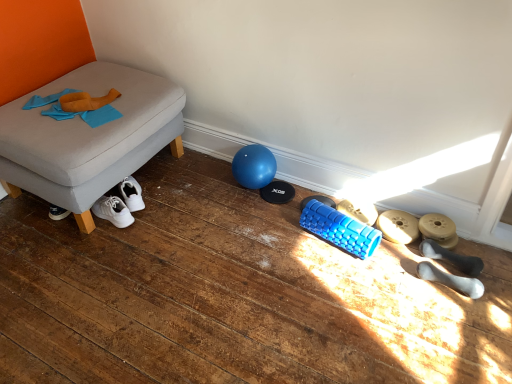
At what (x,y) coordinates should I click in order to perform the action: click on white rubber dumbbells at lower right, the 2th footwear from the front. Please return your answer as a coordinate pair (x, y). The width and height of the screenshot is (512, 384). Looking at the image, I should click on (452, 258).

What do you see at coordinates (451, 280) in the screenshot?
I see `white rubber dumbbell at lower right, which ranks as the first footwear in front-to-back order` at bounding box center [451, 280].

What is the approximate height of gray fabric ottoman at left?

The height of gray fabric ottoman at left is 18.77 inches.

The image size is (512, 384). I want to click on matte gold dumbbell at lower right, positioned as the 3th footwear in back-to-front order, so click(438, 229).

This screenshot has height=384, width=512. I want to click on white rubber dumbbells at lower right, the 2th footwear from the front, so click(452, 258).

Between gray fabric ottoman at left and blue rubber roller at lower center, the fifth footwear positioned from the front, which one has smaller size?

blue rubber roller at lower center, the fifth footwear positioned from the front.

Is gray fabric ottoman at left completely or partially outside of blue rubber roller at lower center, the fifth footwear positioned from the front?

Yes.

Starting from the gray fabric ottoman at left, which footwear is the 1st one to the right? Please provide its 2D coordinates.

[(359, 211)]

From the image's perspective, between gray fabric ottoman at left and blue rubber roller at lower center, which ranks as the first footwear in back-to-front order, which one is located above?

gray fabric ottoman at left appears higher in the image.

Can you confirm if gray fabric ottoman at left is shorter than white rubber dumbbells at lower right, the 4th footwear from the back?

No.

Does gray fabric ottoman at left appear on the right side of white rubber dumbbells at lower right, the 4th footwear from the back?

Incorrect, gray fabric ottoman at left is not on the right side of white rubber dumbbells at lower right, the 4th footwear from the back.

The width and height of the screenshot is (512, 384). What are the coordinates of `the 1st footwear behind the gray fabric ottoman at left, starting your count from the anchor` in the screenshot? It's located at (452, 258).

Visually, is white rubber dumbbell at lower right, placed as the 5th footwear when sorted from back to front, positioned to the left or to the right of matte gold dumbbell at lower right, acting as the third footwear starting from the front?

white rubber dumbbell at lower right, placed as the 5th footwear when sorted from back to front, is positioned on matte gold dumbbell at lower right, acting as the third footwear starting from the front,'s left side.

Is white rubber dumbbell at lower right, which ranks as the first footwear in front-to-back order, aimed at matte gold dumbbell at lower right, acting as the third footwear starting from the front?

No, white rubber dumbbell at lower right, which ranks as the first footwear in front-to-back order, is not facing towards matte gold dumbbell at lower right, acting as the third footwear starting from the front.

Which is behind, white rubber dumbbell at lower right, which ranks as the first footwear in front-to-back order, or matte gold dumbbell at lower right, acting as the third footwear starting from the front?

matte gold dumbbell at lower right, acting as the third footwear starting from the front, is further away from the camera.

From the image's perspective, does white rubber dumbbell at lower right, which ranks as the first footwear in front-to-back order, appear higher than matte gold dumbbell at lower right, acting as the third footwear starting from the front?

No, from the image's perspective, white rubber dumbbell at lower right, which ranks as the first footwear in front-to-back order, is not above matte gold dumbbell at lower right, acting as the third footwear starting from the front.

Are white rubber dumbbells at lower right, the 4th footwear from the back, and matte gray dumbbell at lower right, which appears as the 4th footwear when viewed from the front, located far from each other?

white rubber dumbbells at lower right, the 4th footwear from the back, is near matte gray dumbbell at lower right, which appears as the 4th footwear when viewed from the front, not far away.

Considering the relative positions of white rubber dumbbells at lower right, the 2th footwear from the front, and matte gray dumbbell at lower right, which appears as the 4th footwear when viewed from the front, in the image provided, is white rubber dumbbells at lower right, the 2th footwear from the front, to the left of matte gray dumbbell at lower right, which appears as the 4th footwear when viewed from the front, from the viewer's perspective?

No.

From a real-world perspective, is white rubber dumbbells at lower right, the 2th footwear from the front, over matte gray dumbbell at lower right, which appears as the 4th footwear when viewed from the front?

Yes, from a real-world perspective, white rubber dumbbells at lower right, the 2th footwear from the front, is above matte gray dumbbell at lower right, which appears as the 4th footwear when viewed from the front.

What's the angular difference between white rubber dumbbell at lower right, which ranks as the first footwear in front-to-back order, and blue rubber roller at lower center, which ranks as the first footwear in back-to-front order,'s facing directions?

The facing directions of white rubber dumbbell at lower right, which ranks as the first footwear in front-to-back order, and blue rubber roller at lower center, which ranks as the first footwear in back-to-front order, are 2.9 degrees apart.

From the picture: Is white rubber dumbbell at lower right, which ranks as the first footwear in front-to-back order, thinner than blue rubber roller at lower center, the fifth footwear positioned from the front?

Yes.

Between white rubber dumbbell at lower right, which ranks as the first footwear in front-to-back order, and blue rubber roller at lower center, the fifth footwear positioned from the front, which one appears on the left side from the viewer's perspective?

blue rubber roller at lower center, the fifth footwear positioned from the front, is more to the left.

From the image's perspective, who appears lower, white rubber dumbbell at lower right, which ranks as the first footwear in front-to-back order, or blue rubber roller at lower center, which ranks as the first footwear in back-to-front order?

white rubber dumbbell at lower right, which ranks as the first footwear in front-to-back order, is shown below in the image.

Which point is more distant from viewer, (452,238) or (432,271)?

Positioned behind is point (452,238).

From a real-world perspective, which object stands above the other?

white rubber dumbbell at lower right, which ranks as the first footwear in front-to-back order.

Is white rubber dumbbell at lower right, placed as the 5th footwear when sorted from back to front, completely or partially inside matte gold dumbbell at lower right, positioned as the 3th footwear in back-to-front order?

No, white rubber dumbbell at lower right, placed as the 5th footwear when sorted from back to front, is located outside of matte gold dumbbell at lower right, positioned as the 3th footwear in back-to-front order.

From the picture: Considering the sizes of objects matte gold dumbbell at lower right, positioned as the 3th footwear in back-to-front order, and white rubber dumbbell at lower right, placed as the 5th footwear when sorted from back to front, in the image provided, who is bigger, matte gold dumbbell at lower right, positioned as the 3th footwear in back-to-front order, or white rubber dumbbell at lower right, placed as the 5th footwear when sorted from back to front,?

white rubber dumbbell at lower right, placed as the 5th footwear when sorted from back to front.

Where is `footwear that is the 1st object to the right of the matte gray dumbbell at lower right, the 2th footwear positioned from the back, starting at the anchor`? footwear that is the 1st object to the right of the matte gray dumbbell at lower right, the 2th footwear positioned from the back, starting at the anchor is located at coordinates (451, 280).

Is white rubber dumbbell at lower right, placed as the 5th footwear when sorted from back to front, wider or thinner than matte gray dumbbell at lower right, which appears as the 4th footwear when viewed from the front?

Clearly, white rubber dumbbell at lower right, placed as the 5th footwear when sorted from back to front, has less width compared to matte gray dumbbell at lower right, which appears as the 4th footwear when viewed from the front.

From a real-world perspective, does white rubber dumbbell at lower right, which ranks as the first footwear in front-to-back order, stand above matte gray dumbbell at lower right, the 2th footwear positioned from the back?

Yes, from a real-world perspective, white rubber dumbbell at lower right, which ranks as the first footwear in front-to-back order, is on top of matte gray dumbbell at lower right, the 2th footwear positioned from the back.

This screenshot has height=384, width=512. There is a blue rubber roller at lower center, which ranks as the first footwear in back-to-front order. In order to click on furniture above it (from a real-world perspective) in this screenshot , I will do `click(89, 136)`.

Find the location of a particular element. This screenshot has height=384, width=512. the 4th footwear below the gray fabric ottoman at left (from the image's perspective) is located at coordinates (452, 258).

Based on their spatial positions, is blue rubber roller at lower center, which ranks as the first footwear in back-to-front order, or white rubber dumbbell at lower right, placed as the 5th footwear when sorted from back to front, closer to matte gold dumbbell at lower right, positioned as the 3th footwear in back-to-front order?

Among the two, white rubber dumbbell at lower right, placed as the 5th footwear when sorted from back to front, is located nearer to matte gold dumbbell at lower right, positioned as the 3th footwear in back-to-front order.

Considering their positions, is white rubber dumbbells at lower right, the 2th footwear from the front, positioned further to matte gold dumbbell at lower right, acting as the third footwear starting from the front, than gray fabric ottoman at left?

gray fabric ottoman at left lies further to matte gold dumbbell at lower right, acting as the third footwear starting from the front, than the other object.

From the image, which object appears to be nearer to gray fabric ottoman at left, white rubber dumbbell at lower right, placed as the 5th footwear when sorted from back to front, or matte gray dumbbell at lower right, which appears as the 4th footwear when viewed from the front?

Among the two, matte gray dumbbell at lower right, which appears as the 4th footwear when viewed from the front, is located nearer to gray fabric ottoman at left.

Looking at the image, which one is located further to white rubber dumbbell at lower right, placed as the 5th footwear when sorted from back to front, blue rubber roller at lower center, which ranks as the first footwear in back-to-front order, or white rubber dumbbells at lower right, the 4th footwear from the back?

blue rubber roller at lower center, which ranks as the first footwear in back-to-front order.

Looking at the image, which one is located further to white rubber dumbbells at lower right, the 2th footwear from the front, gray fabric ottoman at left or white rubber dumbbell at lower right, which ranks as the first footwear in front-to-back order?

gray fabric ottoman at left is positioned further to the anchor white rubber dumbbells at lower right, the 2th footwear from the front.

Looking at the image, which one is located closer to matte gray dumbbell at lower right, the 2th footwear positioned from the back, matte gold dumbbell at lower right, positioned as the 3th footwear in back-to-front order, or white rubber dumbbells at lower right, the 4th footwear from the back?

Based on the image, matte gold dumbbell at lower right, positioned as the 3th footwear in back-to-front order, appears to be nearer to matte gray dumbbell at lower right, the 2th footwear positioned from the back.

Estimate the real-world distances between objects in this image. Which object is further from matte gray dumbbell at lower right, which appears as the 4th footwear when viewed from the front, white rubber dumbbell at lower right, which ranks as the first footwear in front-to-back order, or matte gold dumbbell at lower right, positioned as the 3th footwear in back-to-front order?

Based on the image, white rubber dumbbell at lower right, which ranks as the first footwear in front-to-back order, appears to be further to matte gray dumbbell at lower right, which appears as the 4th footwear when viewed from the front.

Considering their positions, is white rubber dumbbells at lower right, the 4th footwear from the back, positioned further to white rubber dumbbell at lower right, which ranks as the first footwear in front-to-back order, than matte gold dumbbell at lower right, acting as the third footwear starting from the front?

matte gold dumbbell at lower right, acting as the third footwear starting from the front, is further to white rubber dumbbell at lower right, which ranks as the first footwear in front-to-back order.

Where is `footwear positioned between white rubber dumbbell at lower right, placed as the 5th footwear when sorted from back to front, and matte gold dumbbell at lower right, acting as the third footwear starting from the front, from near to far`? This screenshot has width=512, height=384. footwear positioned between white rubber dumbbell at lower right, placed as the 5th footwear when sorted from back to front, and matte gold dumbbell at lower right, acting as the third footwear starting from the front, from near to far is located at coordinates (452, 258).

Image resolution: width=512 pixels, height=384 pixels. Find the location of `footwear located between gray fabric ottoman at left and matte gray dumbbell at lower right, which appears as the 4th footwear when viewed from the front, in the left-right direction`. footwear located between gray fabric ottoman at left and matte gray dumbbell at lower right, which appears as the 4th footwear when viewed from the front, in the left-right direction is located at coordinates (359, 211).